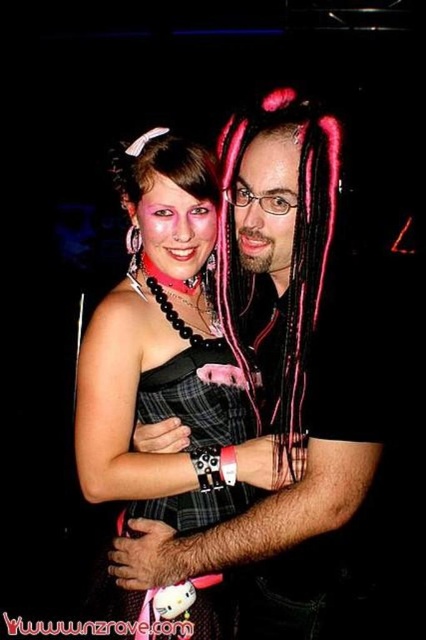
Is matte black dress at center below pink braided hair at center?

Yes.

Measure the distance from matte black dress at center to pink braided hair at center.

matte black dress at center is 17.12 centimeters away from pink braided hair at center.

Which is behind, point (118, 307) or point (279, 356)?

Point (279, 356)

You are a GUI agent. You are given a task and a screenshot of the screen. Output one action in this format:
    pyautogui.click(x=<x>, y=<y>)
    Task: Click on the matte black dress at center
    
    Given the screenshot: What is the action you would take?
    pyautogui.click(x=167, y=356)

Which is more to the left, pink braided hair at center or plaid fabric dress at center?

plaid fabric dress at center

Which of these two, pink braided hair at center or plaid fabric dress at center, stands shorter?

Standing shorter between the two is plaid fabric dress at center.

Who is more forward, (307, 179) or (244, 394)?

Point (307, 179) is in front.

Locate an element on the screen. pink braided hair at center is located at coordinates (287, 266).

This screenshot has width=426, height=640. Describe the element at coordinates (167, 356) in the screenshot. I see `matte black dress at center` at that location.

Who is higher up, matte black dress at center or plaid fabric dress at center?

Positioned higher is matte black dress at center.

Measure the distance between matte black dress at center and camera.

A distance of 4.11 feet exists between matte black dress at center and camera.

In order to click on matte black dress at center in this screenshot , I will do `click(167, 356)`.